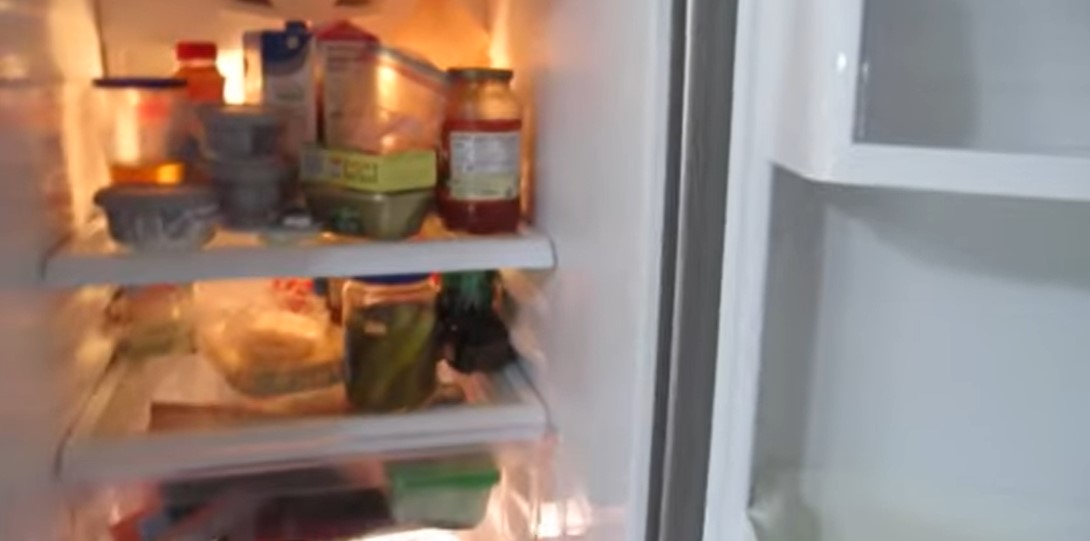
Locate an element on the screen. tupperware is located at coordinates (448, 478), (399, 60), (144, 116).